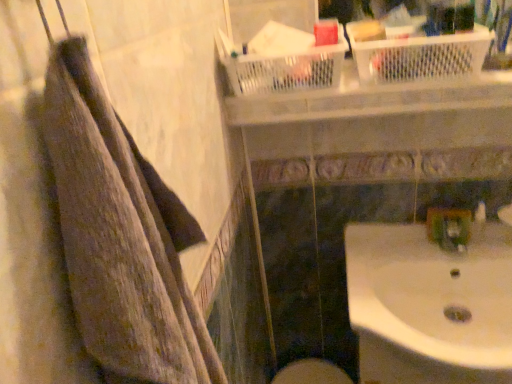
Where is `vacant area situated to the left side of green plastic faucet at lower right`? This screenshot has width=512, height=384. vacant area situated to the left side of green plastic faucet at lower right is located at coordinates (391, 253).